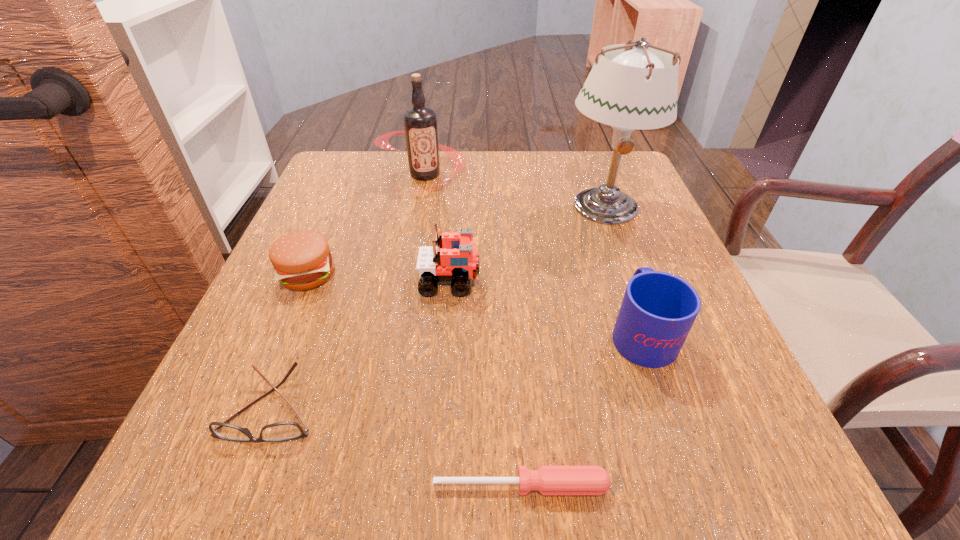
The width and height of the screenshot is (960, 540). What are the coordinates of `screwdriver that is at the near edge` in the screenshot? It's located at (549, 480).

Locate an element on the screen. This screenshot has height=540, width=960. root beer present at the left edge is located at coordinates click(420, 124).

You are a GUI agent. You are given a task and a screenshot of the screen. Output one action in this format:
    pyautogui.click(x=<x>, y=<y>)
    Task: Click on the hamburger situated at the left edge
    The width and height of the screenshot is (960, 540).
    Given the screenshot: What is the action you would take?
    pyautogui.click(x=302, y=260)

This screenshot has width=960, height=540. I want to click on spectacles that is positioned at the left edge, so click(x=281, y=431).

Find the location of a particular element. The image size is (960, 540). lampshade that is at the right edge is located at coordinates (637, 89).

Find the location of a particular element. The width and height of the screenshot is (960, 540). mug present at the right edge is located at coordinates (658, 310).

Locate an element on the screen. object that is positioned at the far left corner is located at coordinates (420, 124).

This screenshot has width=960, height=540. I want to click on object present at the near left corner, so click(281, 431).

Identify the location of object that is positioned at the far right corner. This screenshot has height=540, width=960. (637, 89).

Identify the location of free point at the far edge. Image resolution: width=960 pixels, height=540 pixels. (532, 164).